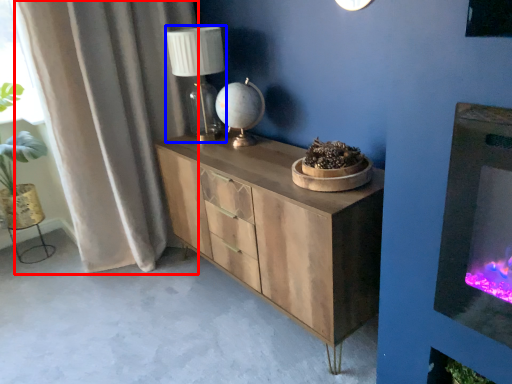
Question: Which object is closer to the camera taking this photo, curtain (highlighted by a red box) or table lamp (highlighted by a blue box)?

Choices:
 (A) curtain
 (B) table lamp

Answer: (A)